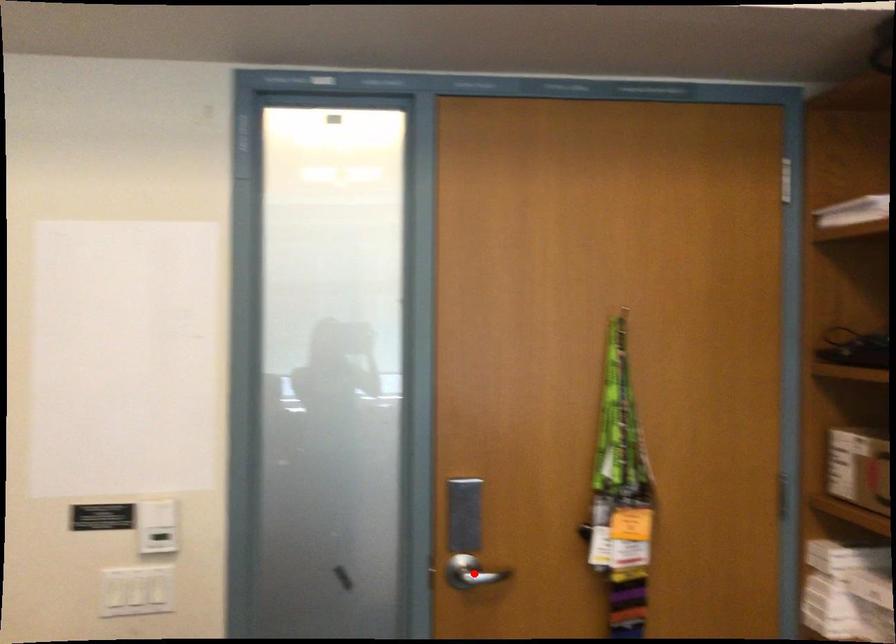
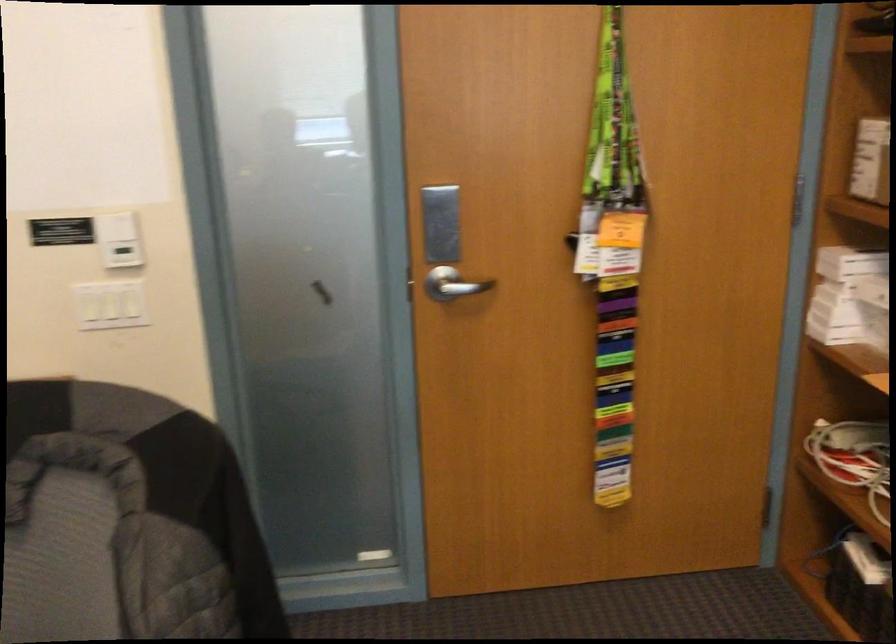
The point at the highlighted location is marked in the first image. Where is the corresponding point in the second image?

(452, 283)